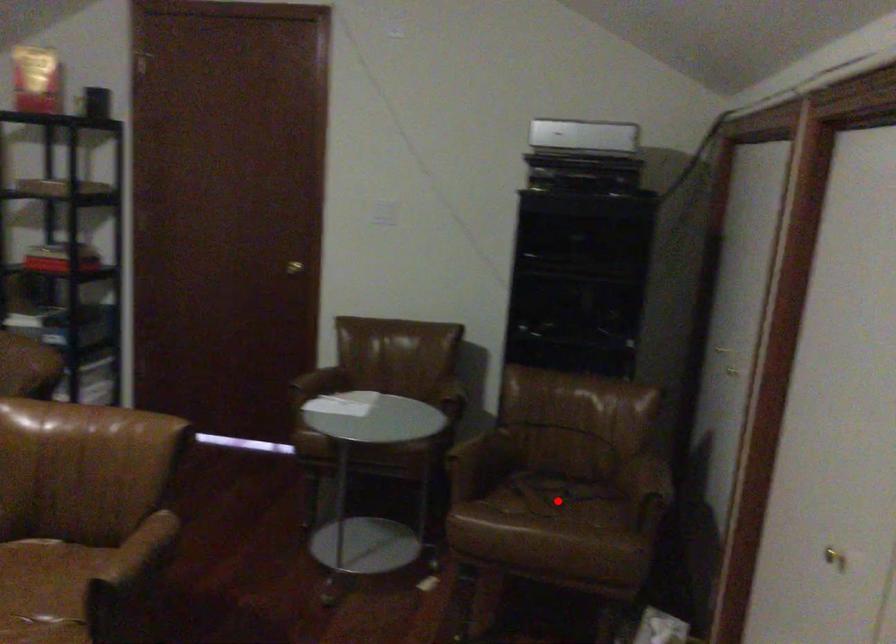
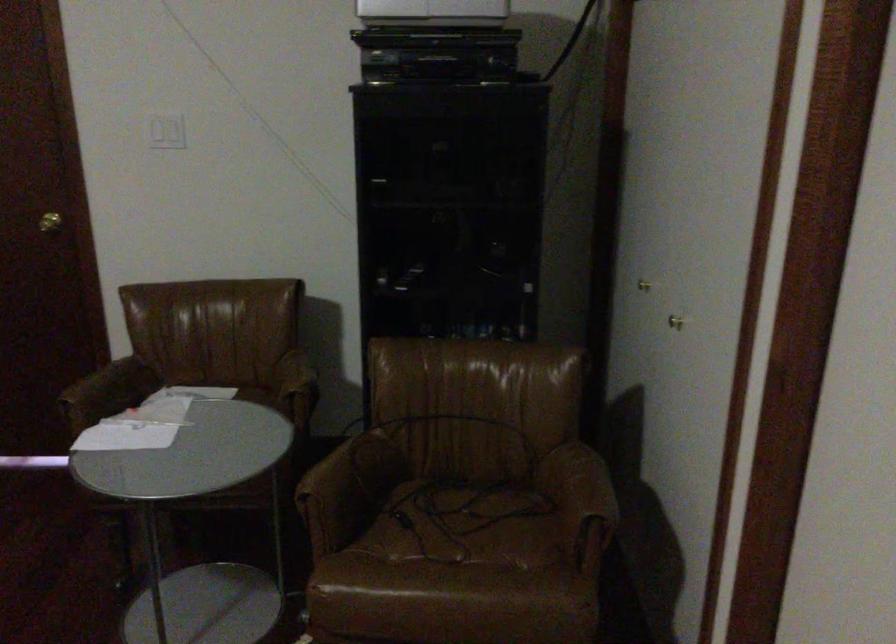
Question: I am providing you with two images of the same scene from different viewpoints. A red point is shown in image1. For the corresponding object point in image2, is it positioned nearer or farther from the camera?

Choices:
 (A) Nearer
 (B) Farther

Answer: (A)